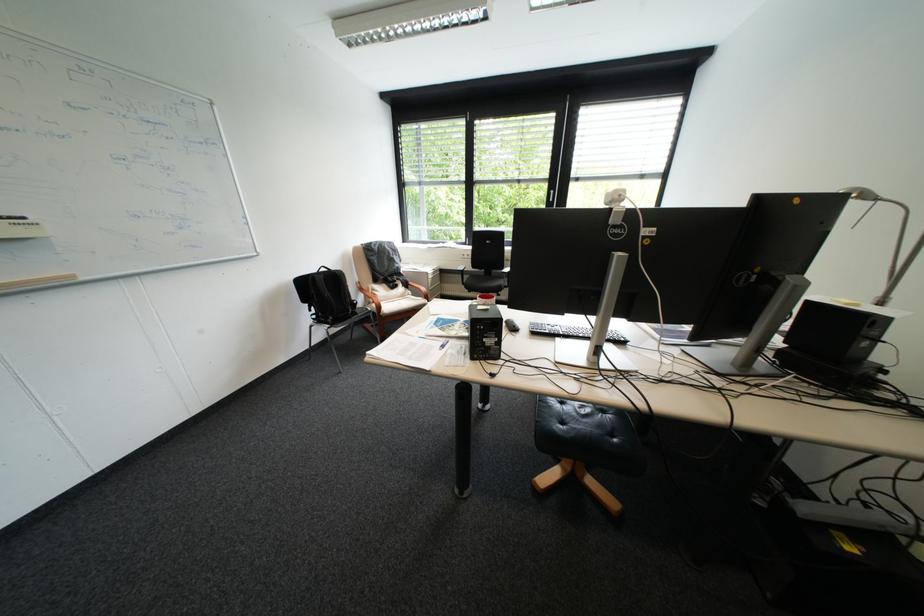
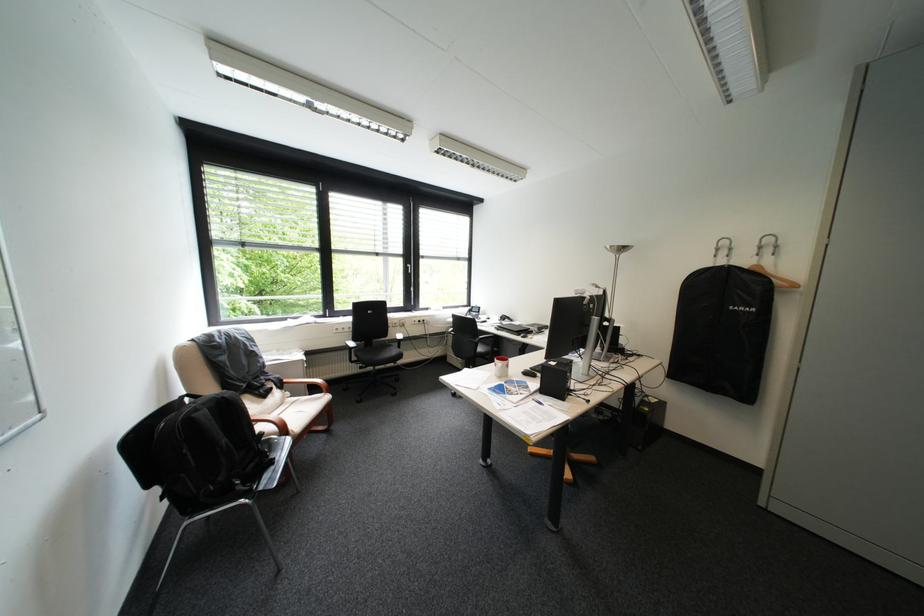
Find the pixel in the second image that matches point 347,273 in the first image.

(236, 398)